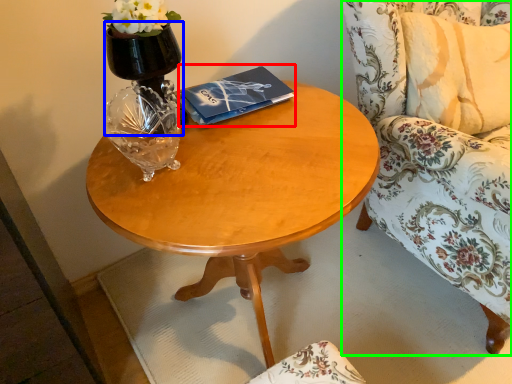
Question: Estimate the real-world distances between objects in this image. Which object is closer to paperback book (highlighted by a red box), vase (highlighted by a blue box) or chair (highlighted by a green box)?

Choices:
 (A) vase
 (B) chair

Answer: (A)